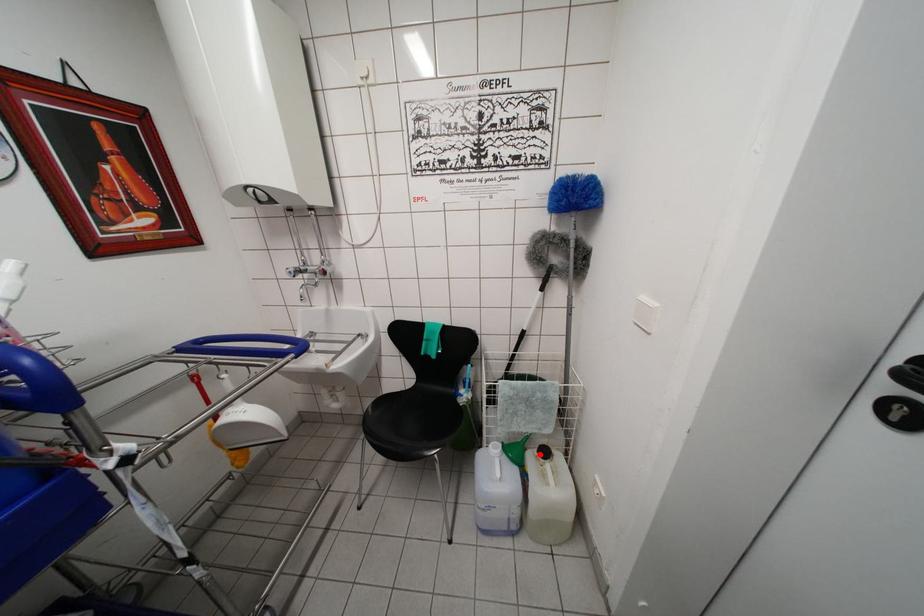
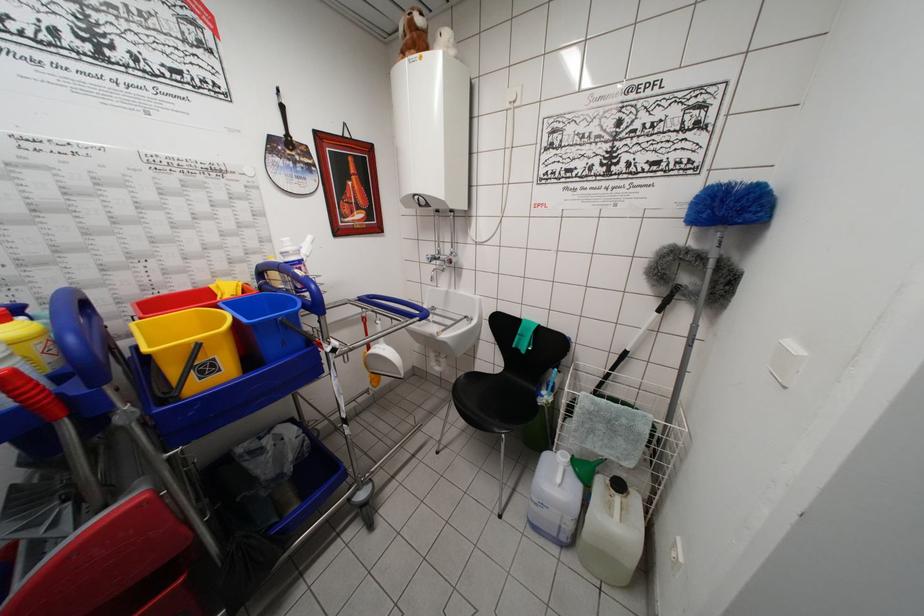
Question: I am providing you with two images of the same scene from different viewpoints. Given a red point in image1, look at the same physical point in image2. Is it:

Choices:
 (A) Closer to the viewpoint
 (B) Farther from the viewpoint

Answer: (A)